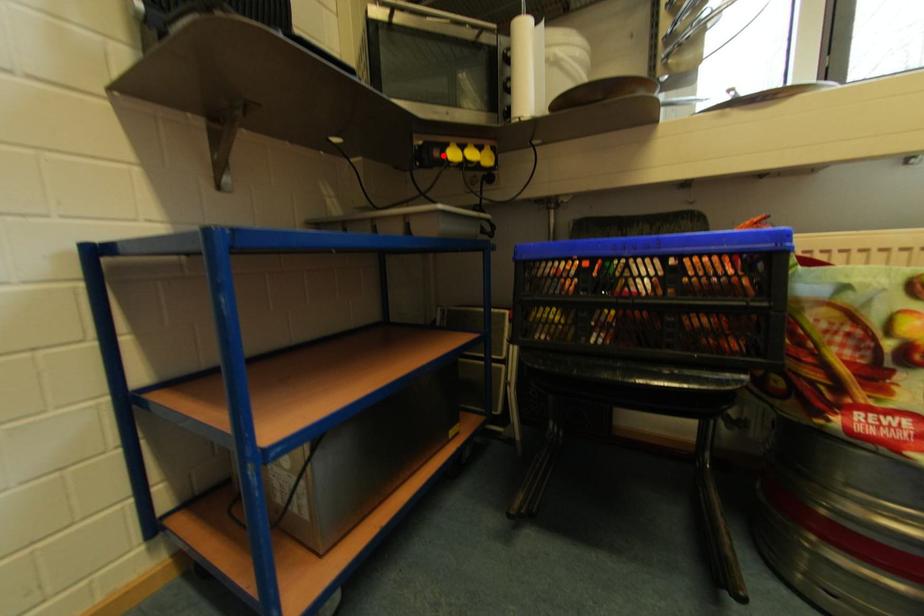
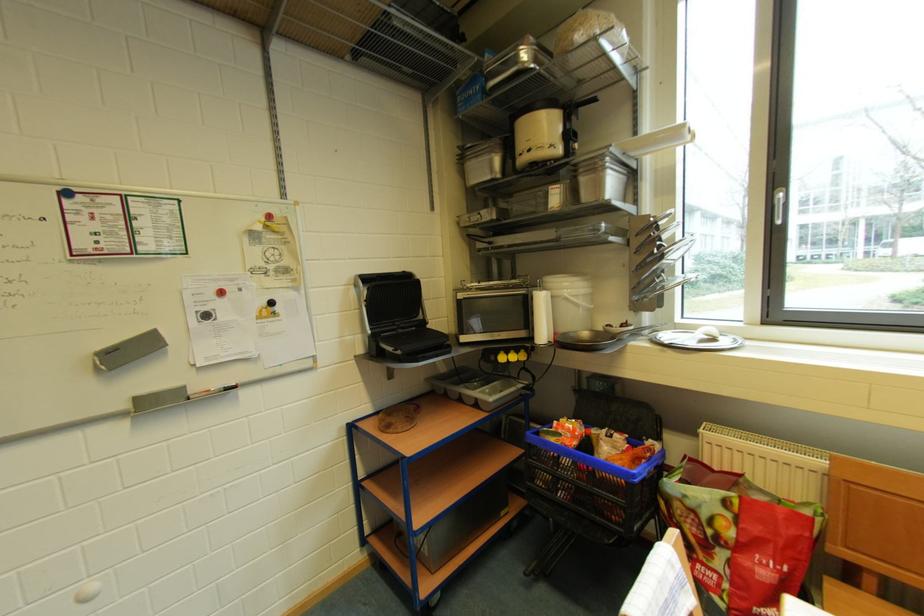
Find the pixel in the second image that matches the highlighted location in the first image.

(500, 361)